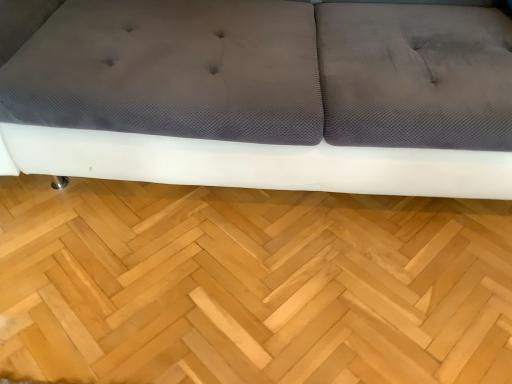
This screenshot has height=384, width=512. What do you see at coordinates (265, 96) in the screenshot? I see `matte gray fabric couch at center` at bounding box center [265, 96].

This screenshot has height=384, width=512. I want to click on matte gray fabric couch at center, so click(x=265, y=96).

Image resolution: width=512 pixels, height=384 pixels. What do you see at coordinates (252, 285) in the screenshot?
I see `natural wood floor at center` at bounding box center [252, 285].

You are a GUI agent. You are given a task and a screenshot of the screen. Output one action in this format:
    pyautogui.click(x=<x>, y=<y>)
    Task: Click on the natural wood floor at center
    
    Given the screenshot: What is the action you would take?
    pyautogui.click(x=252, y=285)

At what (x,y) coordinates should I click in order to perform the action: click on matte gray fabric couch at center. Please return your answer as a coordinate pair (x, y). Looking at the image, I should click on (265, 96).

Is matte gray fabric couch at center to the right of natural wood floor at center from the viewer's perspective?

Yes, matte gray fabric couch at center is to the right of natural wood floor at center.

Relative to natural wood floor at center, is matte gray fabric couch at center in front or behind?

Visually, matte gray fabric couch at center is located in front of natural wood floor at center.

Is point (399, 79) positioned after point (177, 366)?

Yes, point (399, 79) is behind point (177, 366).

Consider the image. From the image's perspective, is matte gray fabric couch at center beneath natural wood floor at center?

No, from the image's perspective, matte gray fabric couch at center is not below natural wood floor at center.

From a real-world perspective, is matte gray fabric couch at center positioned above or below natural wood floor at center?

matte gray fabric couch at center is above natural wood floor at center.

Considering the sizes of objects matte gray fabric couch at center and natural wood floor at center in the image provided, who is wider, matte gray fabric couch at center or natural wood floor at center?

matte gray fabric couch at center is wider.

Who is taller, matte gray fabric couch at center or natural wood floor at center?

Standing taller between the two is matte gray fabric couch at center.

Consider the image. Between matte gray fabric couch at center and natural wood floor at center, which one has larger size?

matte gray fabric couch at center is bigger.

Is matte gray fabric couch at center not inside natural wood floor at center?

Yes, matte gray fabric couch at center is not within natural wood floor at center.

Is matte gray fabric couch at center directly adjacent to natural wood floor at center?

No, matte gray fabric couch at center is not making contact with natural wood floor at center.

Is natural wood floor at center at the back of matte gray fabric couch at center?

No, natural wood floor at center is not at the back of matte gray fabric couch at center.

How much distance is there between matte gray fabric couch at center and natural wood floor at center?

14.54 inches.

Image resolution: width=512 pixels, height=384 pixels. I want to click on hardwood that is on the left side of matte gray fabric couch at center, so click(252, 285).

Considering the positions of objects natural wood floor at center and matte gray fabric couch at center in the image provided, who is more to the right, natural wood floor at center or matte gray fabric couch at center?

matte gray fabric couch at center.

Is the position of natural wood floor at center more distant than that of matte gray fabric couch at center?

Yes, it is behind matte gray fabric couch at center.

Is point (15, 255) positioned before point (37, 65)?

That is False.

In the scene shown: From the image's perspective, which is below, natural wood floor at center or matte gray fabric couch at center?

natural wood floor at center appears lower in the image.

From a real-world perspective, is natural wood floor at center physically located above or below matte gray fabric couch at center?

natural wood floor at center is situated lower than matte gray fabric couch at center in the real world.

Which of these two, natural wood floor at center or matte gray fabric couch at center, is wider?

matte gray fabric couch at center.

In terms of height, does natural wood floor at center look taller or shorter compared to matte gray fabric couch at center?

natural wood floor at center is shorter than matte gray fabric couch at center.

Based on the photo, can you confirm if natural wood floor at center is smaller than matte gray fabric couch at center?

Correct, natural wood floor at center occupies less space than matte gray fabric couch at center.

Is natural wood floor at center located outside matte gray fabric couch at center?

Indeed, natural wood floor at center is completely outside matte gray fabric couch at center.

Does natural wood floor at center touch matte gray fabric couch at center?

natural wood floor at center and matte gray fabric couch at center are clearly separated.

Is natural wood floor at center looking in the opposite direction of matte gray fabric couch at center?

No.

Can you tell me how much natural wood floor at center and matte gray fabric couch at center differ in facing direction?

The angle between the facing direction of natural wood floor at center and the facing direction of matte gray fabric couch at center is 180 degrees.

How distant is natural wood floor at center from matte gray fabric couch at center?

A distance of 14.54 inches exists between natural wood floor at center and matte gray fabric couch at center.

This screenshot has width=512, height=384. Find the location of `hardwood located behind the matte gray fabric couch at center`. hardwood located behind the matte gray fabric couch at center is located at coordinates (252, 285).

This screenshot has height=384, width=512. I want to click on hardwood behind the matte gray fabric couch at center, so click(x=252, y=285).

This screenshot has height=384, width=512. Identify the location of hardwood on the left of matte gray fabric couch at center. (252, 285).